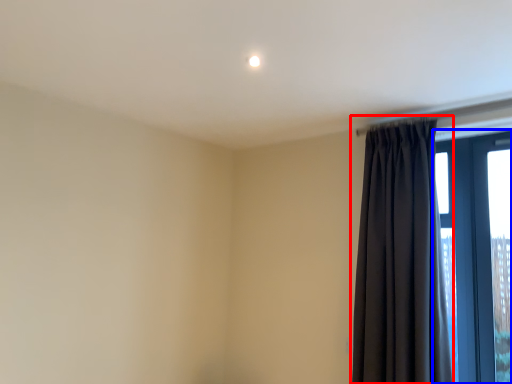
Question: Which of the following is the closest to the observer, curtain (highlighted by a red box) or window (highlighted by a blue box)?

Choices:
 (A) curtain
 (B) window

Answer: (A)